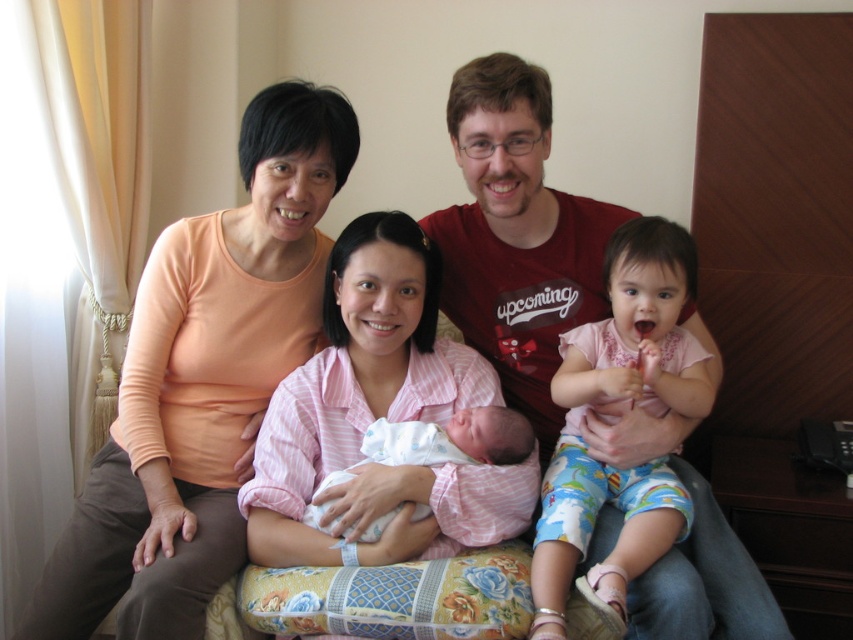
Question: Among these points, which one is farthest from the camera?

Choices:
 (A) (347, 122)
 (B) (407, 280)
 (C) (508, 163)
 (D) (363, 445)

Answer: (D)

Question: Does matte red shirt at center have a lesser width compared to light pink fabric baby at center?

Choices:
 (A) yes
 (B) no

Answer: (B)

Question: Does pink cotton shirt at center have a larger size compared to light pink fabric baby at center?

Choices:
 (A) no
 (B) yes

Answer: (B)

Question: Which point is farther to the camera?

Choices:
 (A) white cotton swaddle at center
 (B) matte red shirt at center
 (C) pink cotton shirt at center

Answer: (A)

Question: Does pink cotton shirt at center have a lesser width compared to white cotton swaddle at center?

Choices:
 (A) no
 (B) yes

Answer: (A)

Question: Among these points, which one is farthest from the camera?

Choices:
 (A) (699, 362)
 (B) (73, 566)
 (C) (392, 442)
 (D) (392, 301)

Answer: (A)